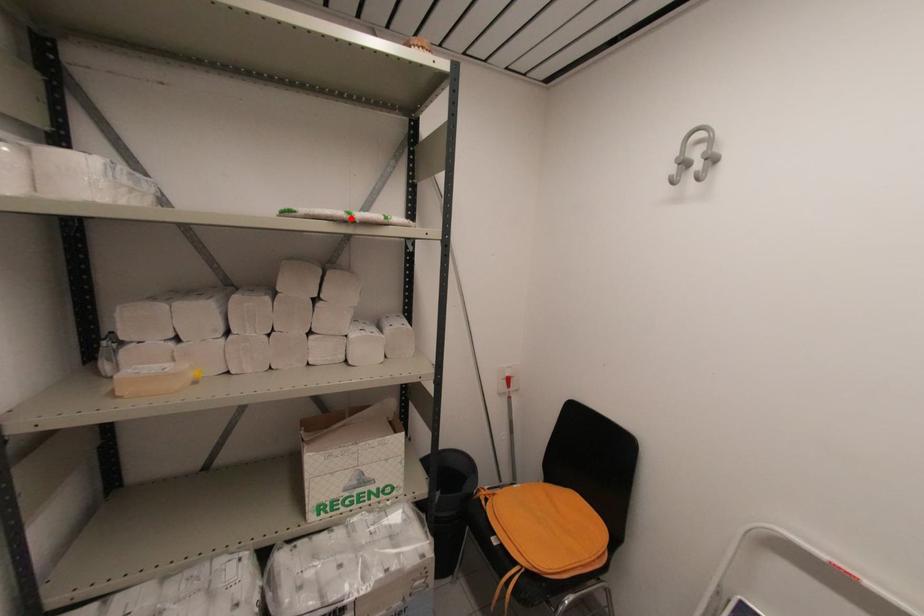
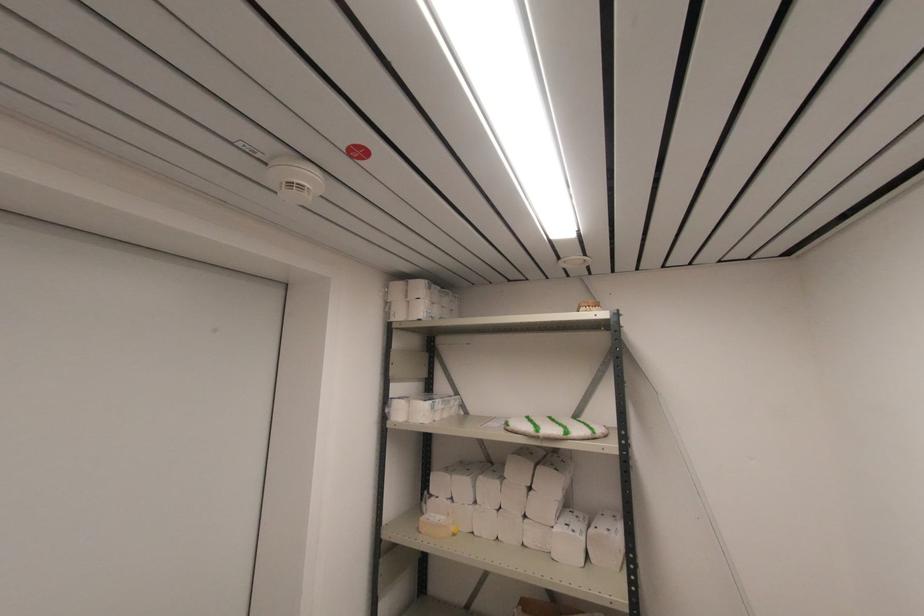
The point at the highlighted location is marked in the first image. Where is the corresponding point in the second image?

(537, 436)